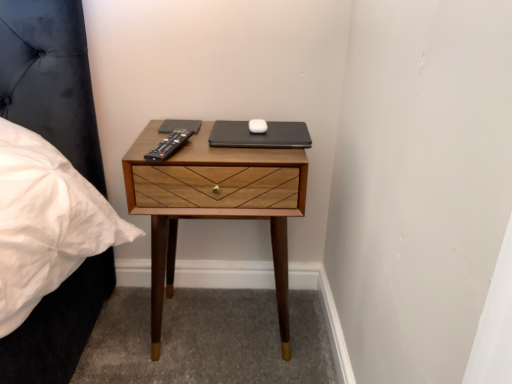
Question: Is wooden nightstand at center far away from black matte laptop at center?

Choices:
 (A) yes
 (B) no

Answer: (B)

Question: Is black matte laptop at center at the back of wooden nightstand at center?

Choices:
 (A) yes
 (B) no

Answer: (B)

Question: Can you confirm if wooden nightstand at center is taller than black matte laptop at center?

Choices:
 (A) yes
 (B) no

Answer: (A)

Question: Is the depth of wooden nightstand at center greater than that of black matte laptop at center?

Choices:
 (A) no
 (B) yes

Answer: (A)

Question: From a real-world perspective, is wooden nightstand at center under black matte laptop at center?

Choices:
 (A) no
 (B) yes

Answer: (B)

Question: Considering the relative positions of wooden nightstand at center and black matte laptop at center in the image provided, is wooden nightstand at center to the left of black matte laptop at center from the viewer's perspective?

Choices:
 (A) no
 (B) yes

Answer: (B)

Question: Is black matte laptop at center not near black plastic remote at center?

Choices:
 (A) no
 (B) yes

Answer: (A)

Question: Can you confirm if black matte laptop at center is shorter than black plastic remote at center?

Choices:
 (A) yes
 (B) no

Answer: (B)

Question: Is black plastic remote at center at the back of black matte laptop at center?

Choices:
 (A) yes
 (B) no

Answer: (B)

Question: Is black matte laptop at center to the right of black plastic remote at center from the viewer's perspective?

Choices:
 (A) yes
 (B) no

Answer: (A)

Question: Would you say black matte laptop at center contains black plastic remote at center?

Choices:
 (A) yes
 (B) no

Answer: (B)

Question: From a real-world perspective, is black matte laptop at center physically above black plastic remote at center?

Choices:
 (A) no
 (B) yes

Answer: (A)

Question: From the image's perspective, is black matte laptop at center located above wooden nightstand at center?

Choices:
 (A) no
 (B) yes

Answer: (B)